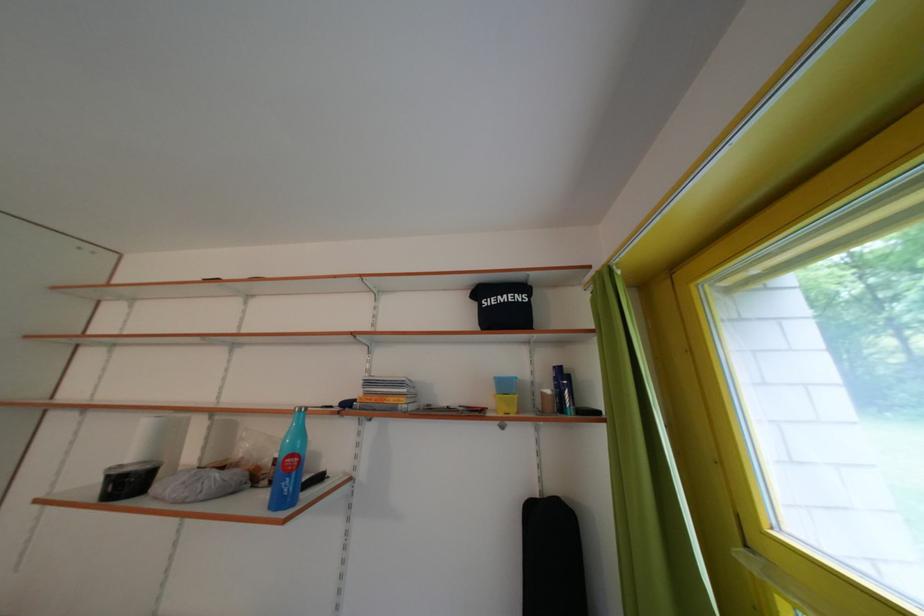
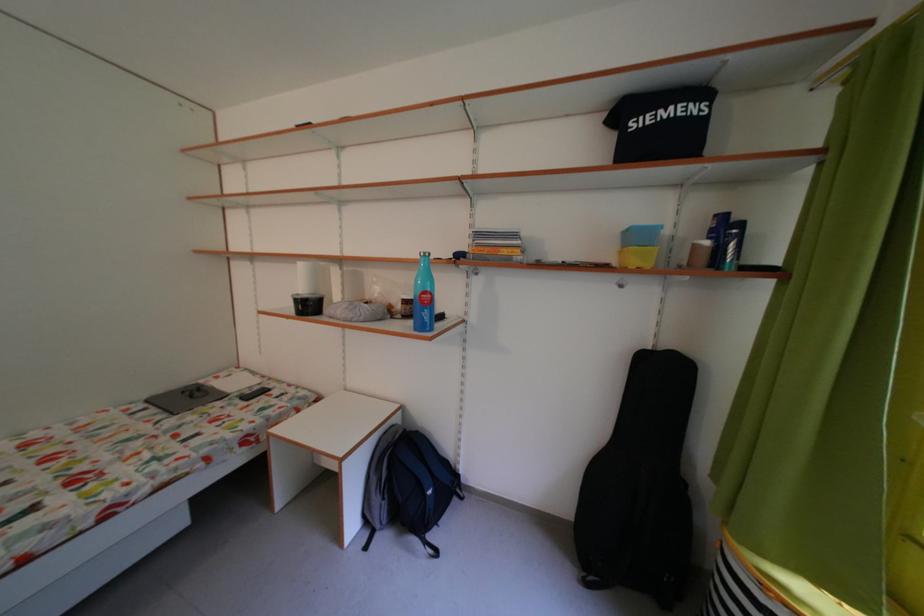
Where in the second image is the point corresponding to pixel 576 411 from the first image?

(736, 265)